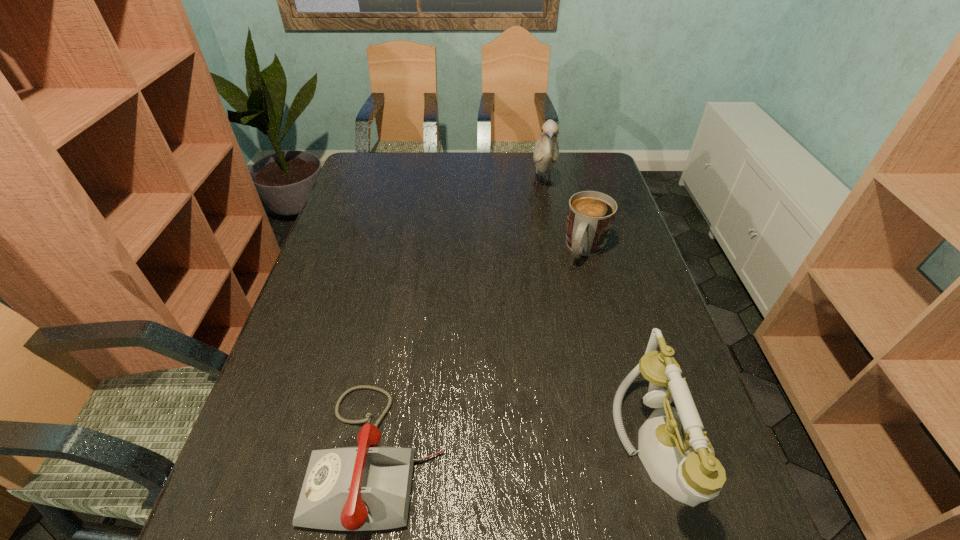
Where is `vacant spot on the desktop that is between the left telephone and the right telephone and is positioned on the side of the second farthest object with the handle`? vacant spot on the desktop that is between the left telephone and the right telephone and is positioned on the side of the second farthest object with the handle is located at coordinates (486, 451).

Locate an element on the screen. The image size is (960, 540). vacant spot on the desktop that is between the left telephone and the second tallest object and is positioned at the beak of the tallest object is located at coordinates (557, 449).